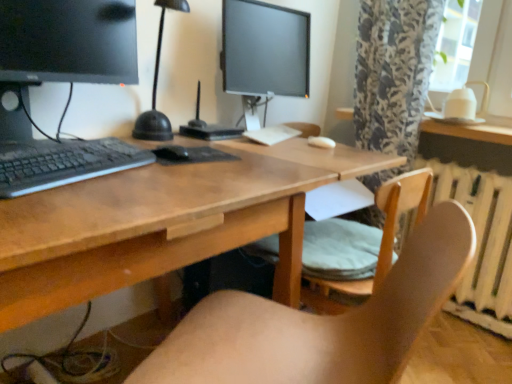
Measure the distance between point (460, 199) and camera.

Point (460, 199) is 5.77 feet away from camera.

You are a GUI agent. You are given a task and a screenshot of the screen. Output one action in this format:
    pyautogui.click(x=<x>, y=<y>)
    Task: Click on the white glossy table at upper right
    
    Given the screenshot: What is the action you would take?
    pyautogui.click(x=470, y=131)

What is the approximate height of white glossy table at upper right?

white glossy table at upper right is 2.84 inches in height.

Find the location of `wooden chair at center, the second chair in the back-to-front sequence`. wooden chair at center, the second chair in the back-to-front sequence is located at coordinates (320, 323).

This screenshot has width=512, height=384. In order to click on wooden chair at lower right, the second chair viewed from the front in this screenshot , I will do `click(362, 239)`.

Describe the element at coordinates (207, 126) in the screenshot. I see `satin black monitor at center` at that location.

Identify the location of matte black monitor at left. This screenshot has height=384, width=512. (61, 81).

Locate an element on the screen. The image size is (512, 384). white painted metal radiator at right is located at coordinates (481, 243).

In the scene shown: Does wooden chair at lower right, which ranks as the first chair in back-to-front order, come in front of matte black monitor at left?

No, wooden chair at lower right, which ranks as the first chair in back-to-front order, is further to the viewer.

Which chair is the 2nd one when counting from the right side of the matte black monitor at left? Please provide its 2D coordinates.

[(362, 239)]

Is wooden chair at lower right, the second chair viewed from the front, not close to matte black monitor at left?

Actually, wooden chair at lower right, the second chair viewed from the front, and matte black monitor at left are a little close together.

Is wooden chair at lower right, which ranks as the first chair in back-to-front order, completely or partially outside of matte black monitor at left?

That's correct, wooden chair at lower right, which ranks as the first chair in back-to-front order, is outside of matte black monitor at left.

Looking at this image, visually, is black matte mouse at center positioned to the left or to the right of black matte keyboard at left?

Clearly, black matte mouse at center is on the right of black matte keyboard at left in the image.

Find the location of a particular element. mouse on the right of black matte keyboard at left is located at coordinates (172, 152).

Which is farther, (x=181, y=150) or (x=21, y=174)?

Point (x=181, y=150)

Is black matte mouse at center completely or partially outside of black matte keyboard at left?

black matte mouse at center is positioned outside black matte keyboard at left.

Does white glossy table at upper right lie in front of black matte mouse at center?

No, white glossy table at upper right is further to the viewer.

Based on their positions, is white glossy table at upper right located to the left or right of black matte mouse at center?

In the image, white glossy table at upper right appears on the right side of black matte mouse at center.

Is white glossy table at upper right placed right next to black matte mouse at center?

They are not placed beside each other.

Is white glossy table at upper right positioned with its back to black matte mouse at center?

No, black matte mouse at center is not at the back of white glossy table at upper right.

Considering the relative positions of black matte keyboard at left and black matte mouse at center in the image provided, is black matte keyboard at left in front of black matte mouse at center?

Yes, black matte keyboard at left is closer to the camera.

Considering the relative positions of black matte keyboard at left and black matte mouse at center in the image provided, is black matte keyboard at left to the right of black matte mouse at center from the viewer's perspective?

Incorrect, black matte keyboard at left is not on the right side of black matte mouse at center.

From the image's perspective, is black matte keyboard at left under black matte mouse at center?

Yes, from the image's perspective, black matte keyboard at left is beneath black matte mouse at center.

Does black matte mouse at center lie in front of wooden chair at lower right, the second chair viewed from the front?

No.

Based on the photo, is black matte mouse at center far away from wooden chair at lower right, the second chair viewed from the front?

black matte mouse at center is near wooden chair at lower right, the second chair viewed from the front, not far away.

Is point (167, 152) positioned behind point (331, 222)?

No, it is not.

From a real-world perspective, which is physically above, black matte mouse at center or wooden chair at lower right, the second chair viewed from the front?

From a 3D spatial view, black matte mouse at center is above.

Measure the distance between wooden chair at center, the 1th chair when ordered from front to back, and wooden chair at lower right, which ranks as the first chair in back-to-front order.

wooden chair at center, the 1th chair when ordered from front to back, and wooden chair at lower right, which ranks as the first chair in back-to-front order, are 27.54 centimeters apart from each other.

This screenshot has width=512, height=384. I want to click on chair lying on the right of wooden chair at center, the 1th chair when ordered from front to back, so click(362, 239).

Does point (401, 277) appear closer or farther from the camera than point (382, 232)?

Point (401, 277).

From the image's perspective, which one is positioned lower, white painted metal radiator at right or wooden desk at center?

From the image's view, wooden desk at center is below.

Considering the sizes of objects white painted metal radiator at right and wooden desk at center in the image provided, who is shorter, white painted metal radiator at right or wooden desk at center?

Standing shorter between the two is white painted metal radiator at right.

Is wooden desk at center located within white painted metal radiator at right?

No, wooden desk at center is located outside of white painted metal radiator at right.

Find the location of a particular element. desktop computer that appears on the left of wooden chair at lower right, which ranks as the first chair in back-to-front order is located at coordinates click(x=61, y=81).

Identify the location of computer keyboard lying in front of the black matte mouse at center. The width and height of the screenshot is (512, 384). pyautogui.click(x=63, y=163).

Considering their positions, is wooden chair at lower right, the second chair viewed from the front, positioned closer to black matte keyboard at left than white painted metal radiator at right?

wooden chair at lower right, the second chair viewed from the front, is closer to black matte keyboard at left.

Based on their spatial positions, is white glossy table at upper right or wooden chair at center, the 1th chair when ordered from front to back, closer to matte black monitor at left?

→ wooden chair at center, the 1th chair when ordered from front to back.

From the image, which object appears to be nearer to satin black monitor at center, black matte mouse at center or white glossy table at upper right?

black matte mouse at center.

Based on their spatial positions, is matte black monitor at left or black matte keyboard at left further from wooden chair at center, the 1th chair when ordered from front to back?

Based on the image, matte black monitor at left appears to be further to wooden chair at center, the 1th chair when ordered from front to back.

Based on their spatial positions, is white glossy table at upper right or matte black monitor at left closer to satin black monitor at center?

The object closer to satin black monitor at center is matte black monitor at left.

Based on their spatial positions, is satin black monitor at center or wooden chair at lower right, the second chair viewed from the front, closer to white glossy table at upper right?

The object closer to white glossy table at upper right is wooden chair at lower right, the second chair viewed from the front.

When comparing their distances from wooden desk at center, does black matte keyboard at left or white glossy table at upper right seem further?

Based on the image, white glossy table at upper right appears to be further to wooden desk at center.

Based on their spatial positions, is matte black monitor at left or white painted metal radiator at right closer to black matte mouse at center?

matte black monitor at left is positioned closer to the anchor black matte mouse at center.

Where is `desktop computer between wooden chair at center, the 1th chair when ordered from front to back, and satin black monitor at center in the front-back direction`? desktop computer between wooden chair at center, the 1th chair when ordered from front to back, and satin black monitor at center in the front-back direction is located at coordinates (61, 81).

At what (x,y) coordinates should I click in order to perform the action: click on desk positioned between wooden chair at center, the 1th chair when ordered from front to back, and black matte mouse at center from near to far. Please return your answer as a coordinate pair (x, y). Looking at the image, I should click on (163, 223).

In order to click on computer located between wooden desk at center and white painted metal radiator at right in the left-right direction in this screenshot , I will do `click(207, 126)`.

This screenshot has width=512, height=384. What are the coordinates of `computer located between black matte keyboard at left and wooden chair at lower right, the second chair viewed from the front, in the left-right direction` in the screenshot? It's located at (207, 126).